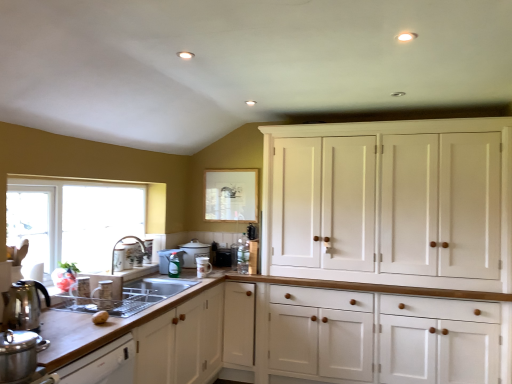
Identify the location of free location to the right of shiny metallic kettle at left. This screenshot has height=384, width=512. (61, 327).